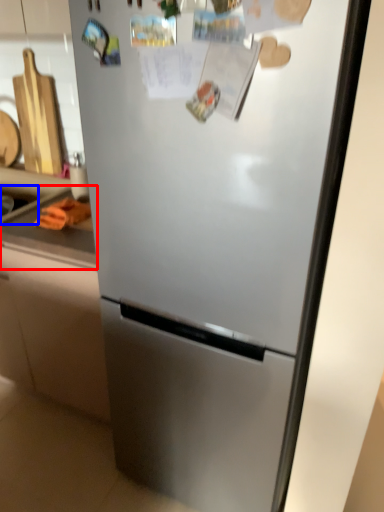
Question: Which of the following is the farthest to the observer, counter top (highlighted by a red box) or sink (highlighted by a blue box)?

Choices:
 (A) counter top
 (B) sink

Answer: (B)